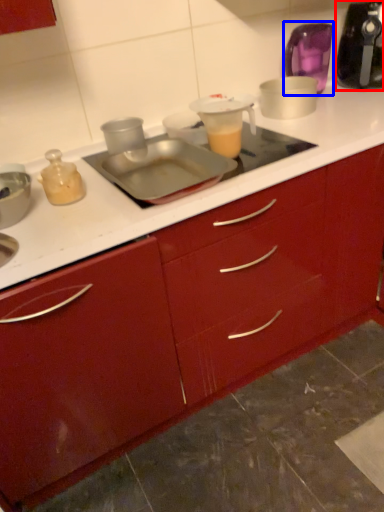
Question: Which of the following is the farthest to the observer, kitchen appliance (highlighted by a red box) or appliance (highlighted by a blue box)?

Choices:
 (A) kitchen appliance
 (B) appliance

Answer: (B)